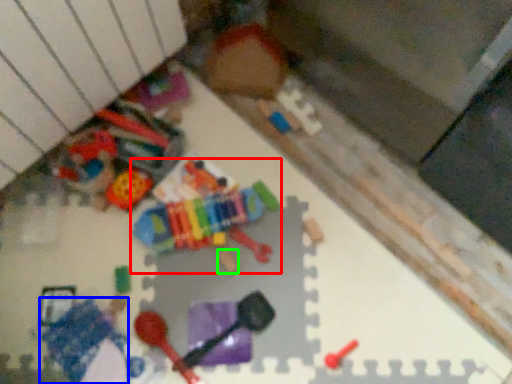
Question: Which is farther away from toy (highlighted by a red box)? toy (highlighted by a blue box) or toy (highlighted by a green box)?

Choices:
 (A) toy
 (B) toy

Answer: (A)